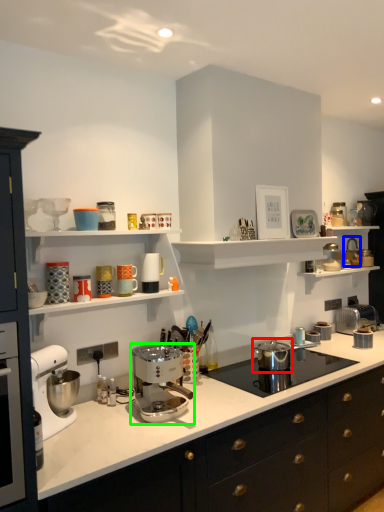
Question: Which is farther away from kitchen appliance (highlighted by a red box)? appliance (highlighted by a blue box) or mixer (highlighted by a green box)?

Choices:
 (A) appliance
 (B) mixer

Answer: (A)